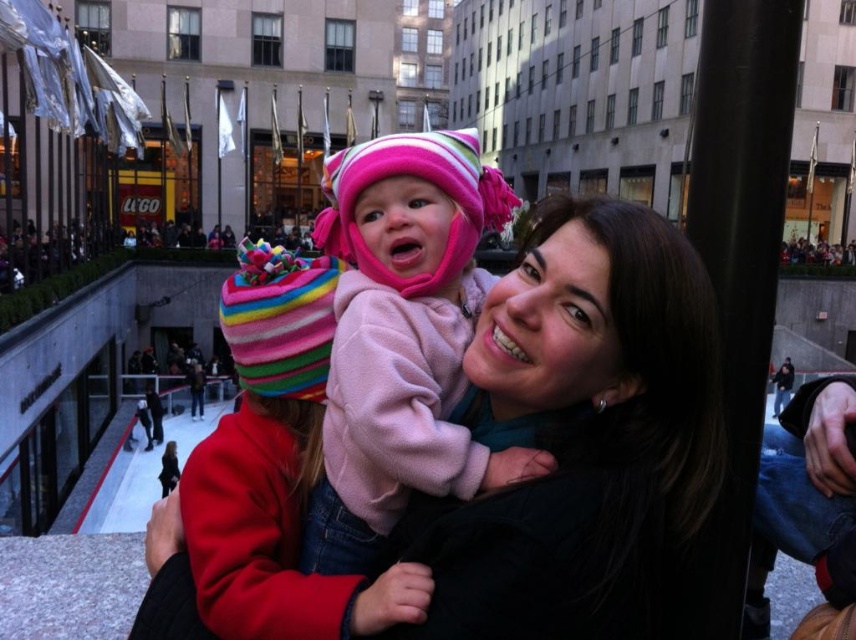
Who is lower down, matte black jacket at center or pink fleece baby at center?

Positioned lower is matte black jacket at center.

Who is more forward, [498,593] or [446,400]?

Positioned in front is point [498,593].

Is point (655, 532) closer to camera compared to point (456, 291)?

Yes, point (655, 532) is closer to viewer.

The image size is (856, 640). Find the location of `matte black jacket at center`. matte black jacket at center is located at coordinates 580,436.